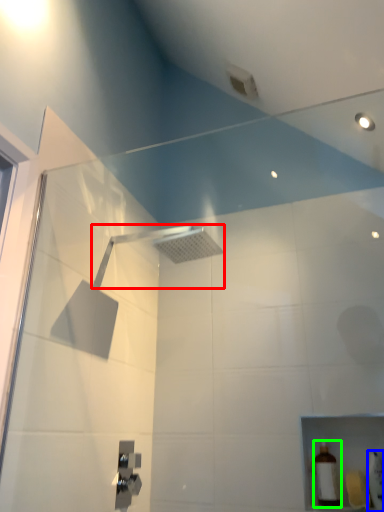
Question: Based on their relative distances, which object is nearer to shower (highlighted by a red box)? Choose from toiletry (highlighted by a blue box) and toiletry (highlighted by a green box).

Choices:
 (A) toiletry
 (B) toiletry

Answer: (B)